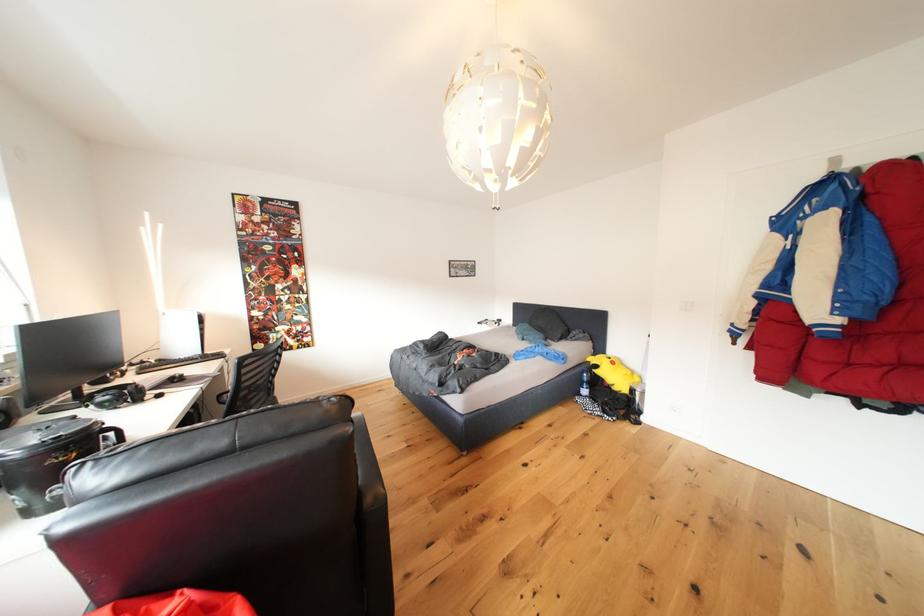
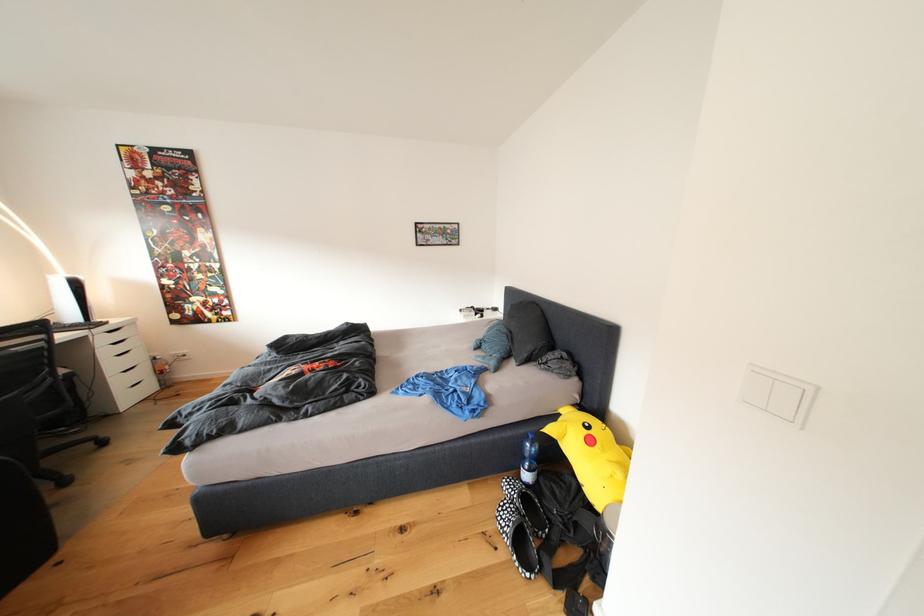
Where in the second image is the point corresponding to the point at 622,368 from the first image?

(600, 446)